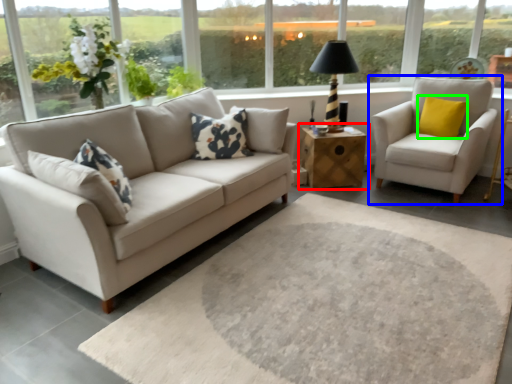
Question: Considering the real-world distances, which object is closest to table (highlighted by a red box)? chair (highlighted by a blue box) or pillow (highlighted by a green box).

Choices:
 (A) chair
 (B) pillow

Answer: (A)